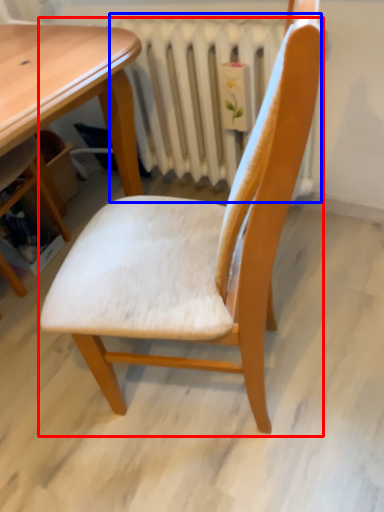
Question: Which point is closer to the camera, chair (highlighted by a red box) or radiator (highlighted by a blue box)?

Choices:
 (A) chair
 (B) radiator

Answer: (A)